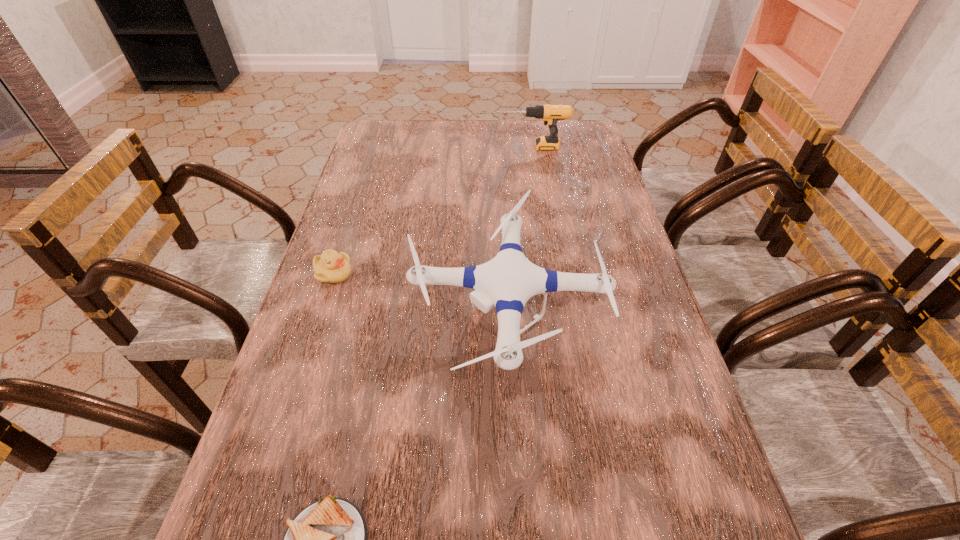
The image size is (960, 540). I want to click on object positioned at the left edge, so click(x=331, y=267).

You are a GUI agent. You are given a task and a screenshot of the screen. Output one action in this format:
    pyautogui.click(x=<x>, y=<y>)
    Task: Click on the drill situated at the right edge
    Image resolution: width=960 pixels, height=540 pixels.
    Given the screenshot: What is the action you would take?
    pyautogui.click(x=550, y=114)

Image resolution: width=960 pixels, height=540 pixels. In order to click on drone that is at the right edge in this screenshot , I will do `click(509, 280)`.

In order to click on object located at the far right corner in this screenshot , I will do `click(550, 114)`.

This screenshot has width=960, height=540. What are the coordinates of `vacant area at the left edge of the desktop` in the screenshot? It's located at (394, 220).

In the image, there is a desktop. Where is `free space at the right edge`? Image resolution: width=960 pixels, height=540 pixels. free space at the right edge is located at coordinates (588, 231).

Locate an element on the screen. The height and width of the screenshot is (540, 960). vacant space at the far right corner of the desktop is located at coordinates (575, 133).

Locate an element on the screen. This screenshot has height=540, width=960. empty location between the second shortest object and the drill is located at coordinates point(432,211).

The width and height of the screenshot is (960, 540). In order to click on vacant region between the duckling and the drill in this screenshot , I will do `click(432, 211)`.

In order to click on blank region between the farthest object and the second shortest object in this screenshot , I will do `click(432, 211)`.